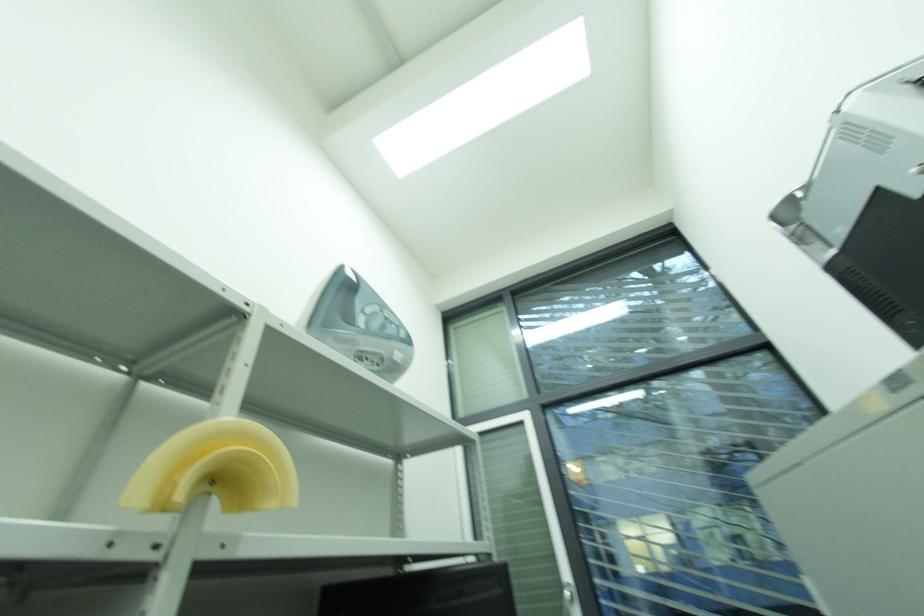
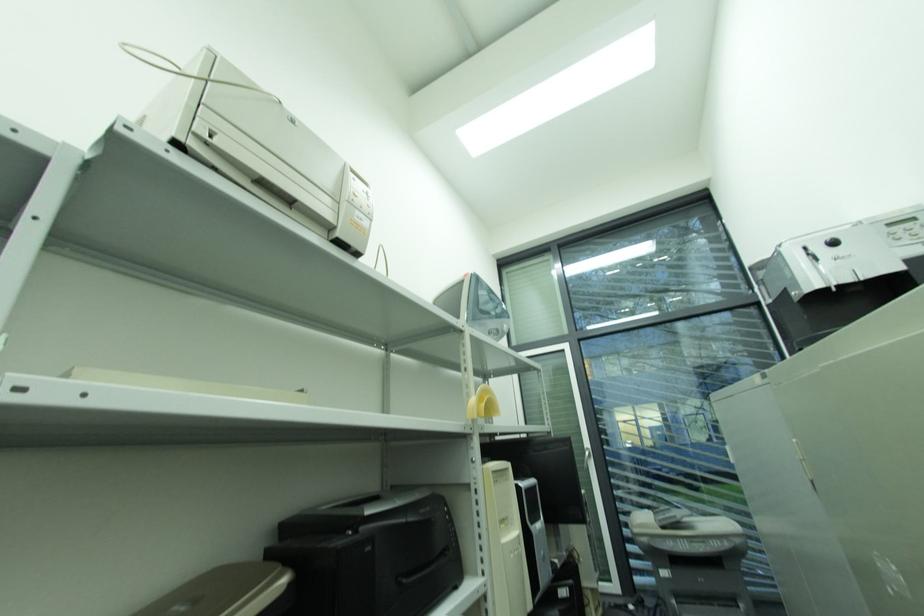
Question: The images are taken continuously from a first-person perspective. In which direction is your viewpoint rotating?

Choices:
 (A) Left
 (B) Right
 (C) Up
 (D) Down

Answer: (D)